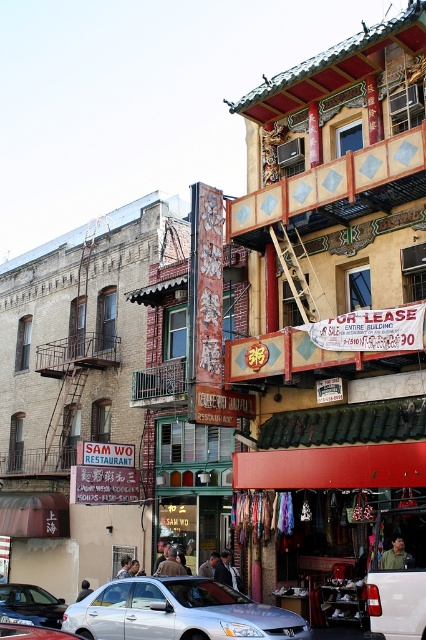
You are a delivery driver who needs to park your truck next to the building on the right. The truck requires a parking space that can accommodate a larger vehicle. Based on the image, which vehicle among the satin silver sedan at lower left and the silver metallic car at center is more suitable as a reference for the required space?

The satin silver sedan at lower left is larger than the silver metallic car at center, so the parking space should be sized to accommodate the satin silver sedan at lower left to ensure it can fit the delivery truck.